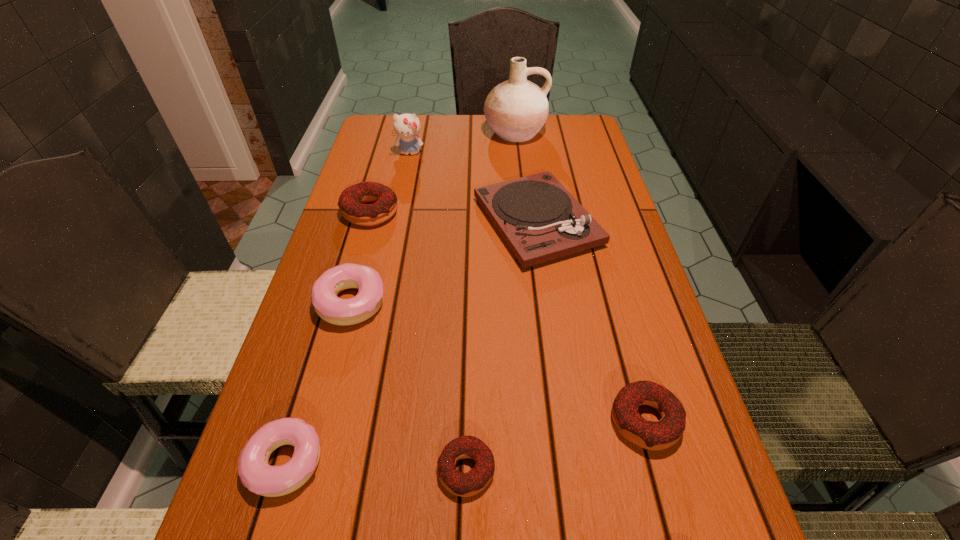
You are a GUI agent. You are given a task and a screenshot of the screen. Output one action in this format:
    pyautogui.click(x=<x>, y=<y>)
    Task: Click on the free space that satisfies the following two spatial constraints: 1. on the front side of the nearer pink doughnut; 2. on the left side of the shortest doughnut
    Image resolution: width=960 pixels, height=540 pixels.
    Given the screenshot: What is the action you would take?
    283,469